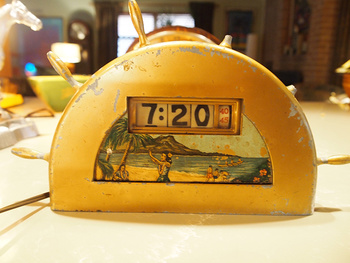
Find the location of `metal bright yellow crescent shaped novelty clock`. metal bright yellow crescent shaped novelty clock is located at coordinates (168, 79).